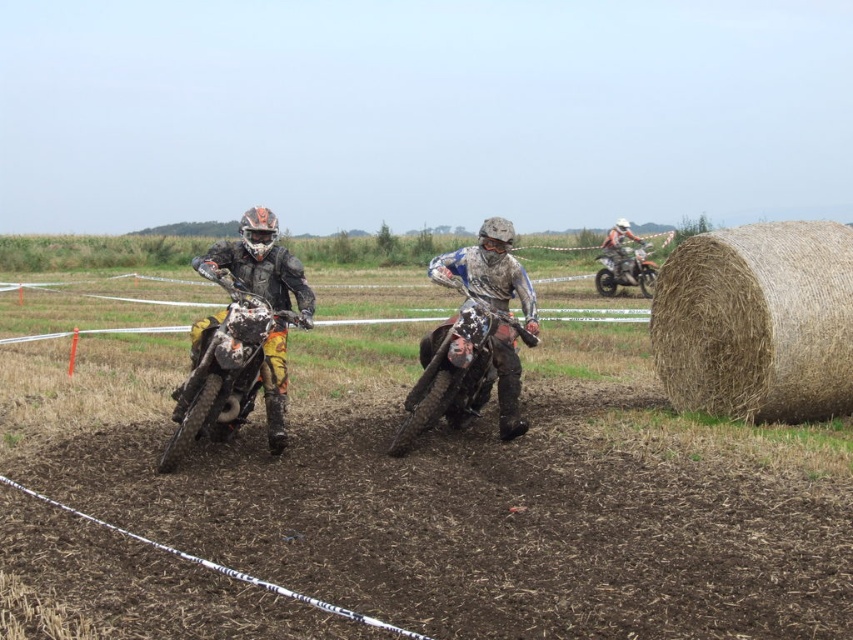
You are a race official checking the track width for safety. The track requires that all motorcycles must not exceed 70 cm in width. You observe the matte orange and white motorcycle at left and the matte black dirt bike at center. Can you determine if either motorcycle violates the width requirement based on their positions?

The matte orange and white motorcycle at left might be wider than matte black dirt bike at center. However, without specific width measurements, it is impossible to confirm if either motorcycle exceeds the 70 cm limit. Further measurements are needed.

You are a spectator standing at the edge of the motocross track. You see the brown straw bale at right and the orange matte dirt bike at right. Which object is closer to you?

The brown straw bale at right is closer to you because it is in front of the orange matte dirt bike at right.